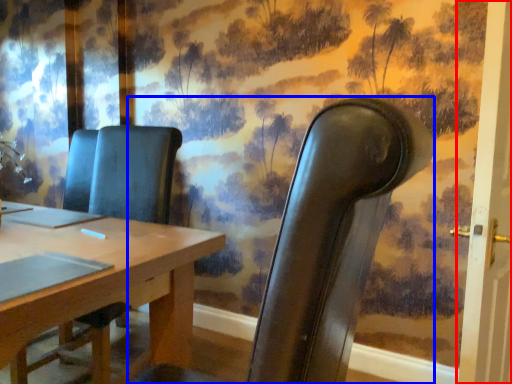
Question: Which object is closer to the camera taking this photo, door (highlighted by a red box) or chair (highlighted by a blue box)?

Choices:
 (A) door
 (B) chair

Answer: (B)